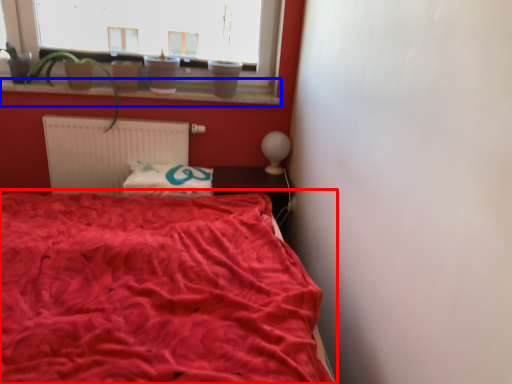
Question: Which point is further to the camera, bed (highlighted by a red box) or window sill (highlighted by a blue box)?

Choices:
 (A) bed
 (B) window sill

Answer: (B)